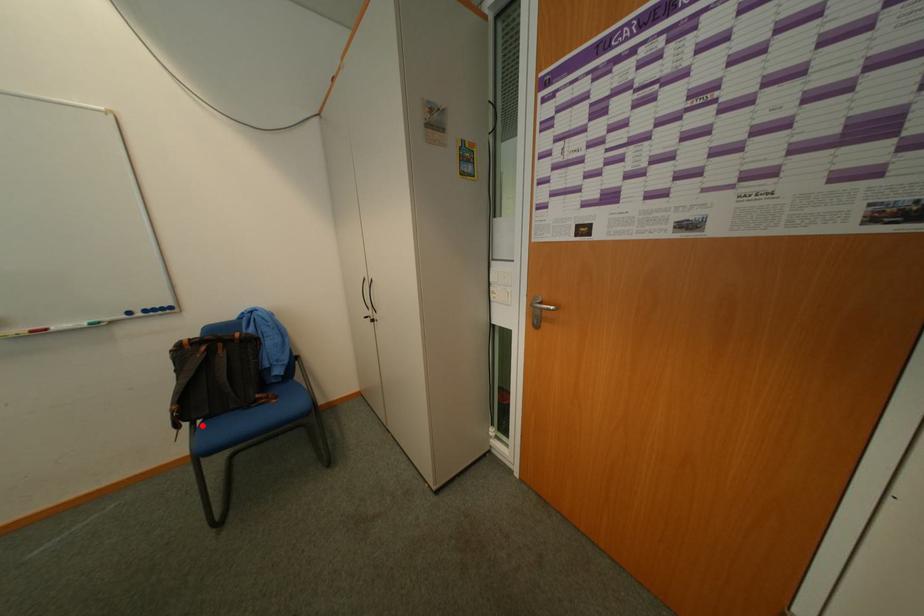
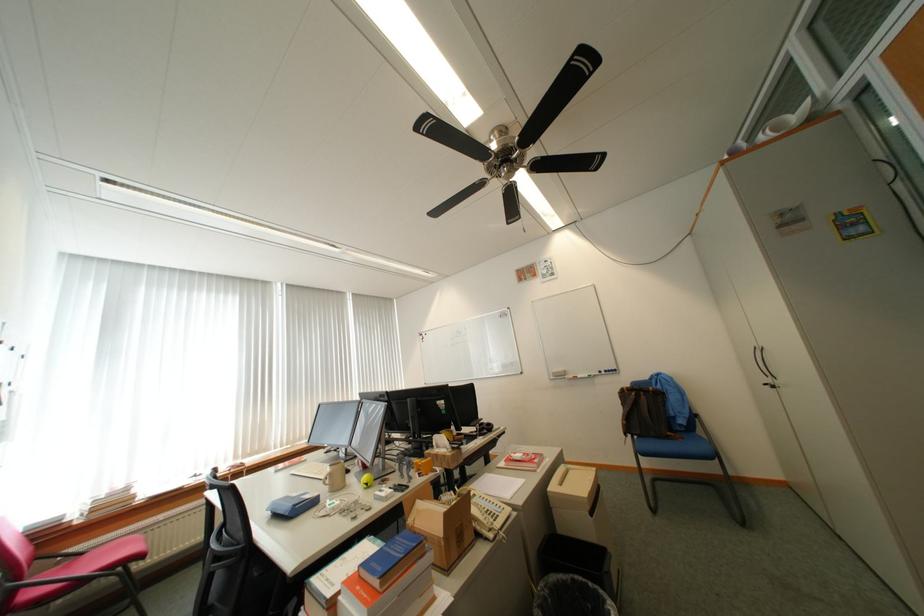
In the second image, find the point that corresponds to the highlighted location in the first image.

(641, 438)